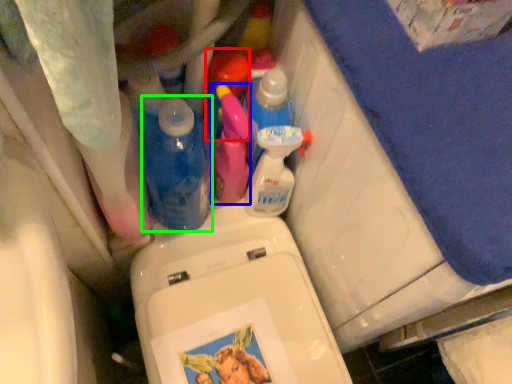
Question: Which object is positioned farthest from cleaning product (highlighted by a red box)? Select from cleaning product (highlighted by a blue box) and bottle (highlighted by a green box).

Choices:
 (A) cleaning product
 (B) bottle

Answer: (B)